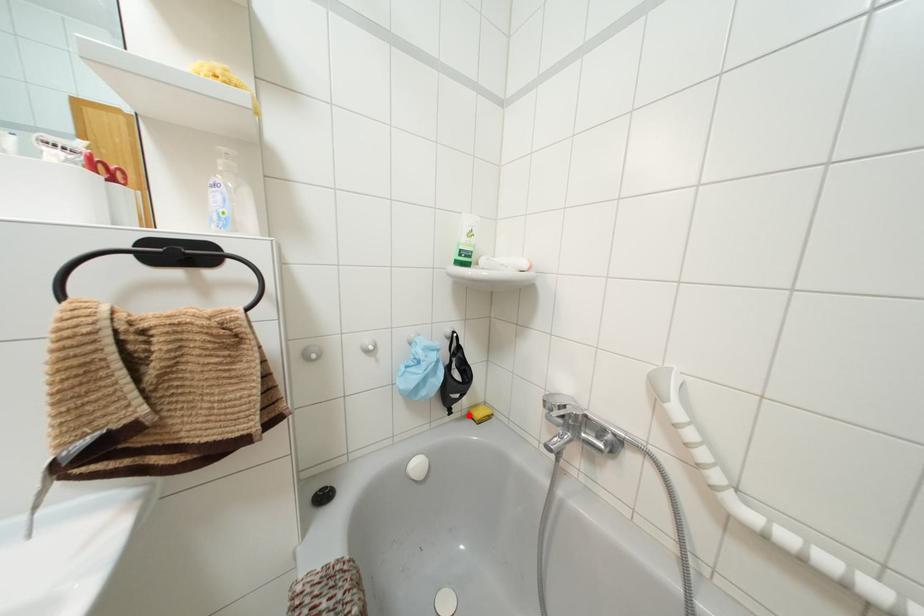
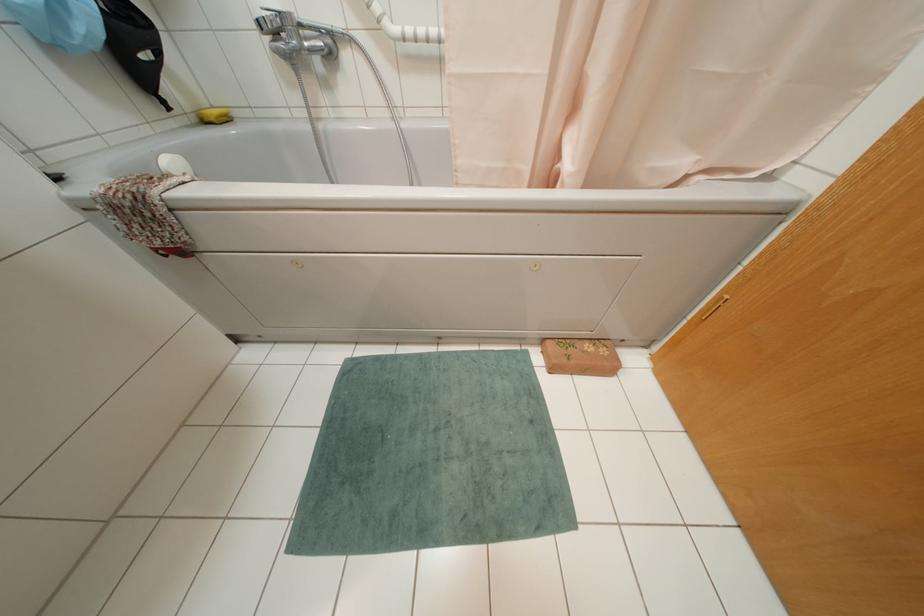
Question: I am providing you with two images of the same scene from different viewpoints. A red point is shown in image1. For the corresponding object point in image2, is it positioned nearer or farther from the camera?

Choices:
 (A) Nearer
 (B) Farther

Answer: (A)